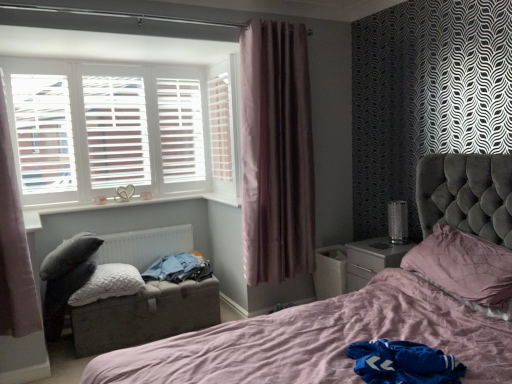
Question: Can you confirm if white wood shutter at upper left is wider than black mesh table lamp at right?

Choices:
 (A) no
 (B) yes

Answer: (A)

Question: Is black mesh table lamp at right a part of white wood shutter at upper left?

Choices:
 (A) no
 (B) yes

Answer: (A)

Question: Does white wood shutter at upper left have a larger size compared to black mesh table lamp at right?

Choices:
 (A) yes
 (B) no

Answer: (A)

Question: Can you confirm if white wood shutter at upper left is shorter than black mesh table lamp at right?

Choices:
 (A) no
 (B) yes

Answer: (A)

Question: Considering the relative sizes of white wood shutter at upper left and black mesh table lamp at right in the image provided, is white wood shutter at upper left smaller than black mesh table lamp at right?

Choices:
 (A) no
 (B) yes

Answer: (A)

Question: Is white wood shutter at upper left completely or partially outside of black mesh table lamp at right?

Choices:
 (A) no
 (B) yes

Answer: (B)

Question: Is the surface of white metallic radiator at lower left in direct contact with matte gray cushioned footrest at lower left?

Choices:
 (A) yes
 (B) no

Answer: (B)

Question: Does white metallic radiator at lower left have a larger size compared to matte gray cushioned footrest at lower left?

Choices:
 (A) yes
 (B) no

Answer: (B)

Question: Does white metallic radiator at lower left have a lesser width compared to matte gray cushioned footrest at lower left?

Choices:
 (A) no
 (B) yes

Answer: (B)

Question: Is white metallic radiator at lower left shorter than matte gray cushioned footrest at lower left?

Choices:
 (A) no
 (B) yes

Answer: (A)

Question: Are white metallic radiator at lower left and matte gray cushioned footrest at lower left located far from each other?

Choices:
 (A) yes
 (B) no

Answer: (B)

Question: Is white metallic radiator at lower left positioned behind matte gray cushioned footrest at lower left?

Choices:
 (A) yes
 (B) no

Answer: (A)

Question: From a real-world perspective, is black mesh table lamp at right located higher than white glossy nightstand at lower right?

Choices:
 (A) yes
 (B) no

Answer: (A)